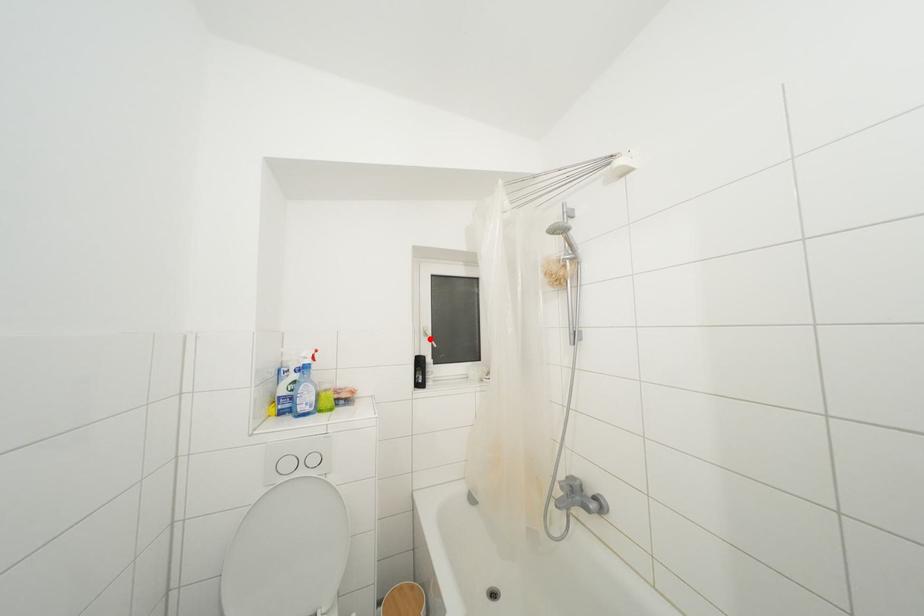
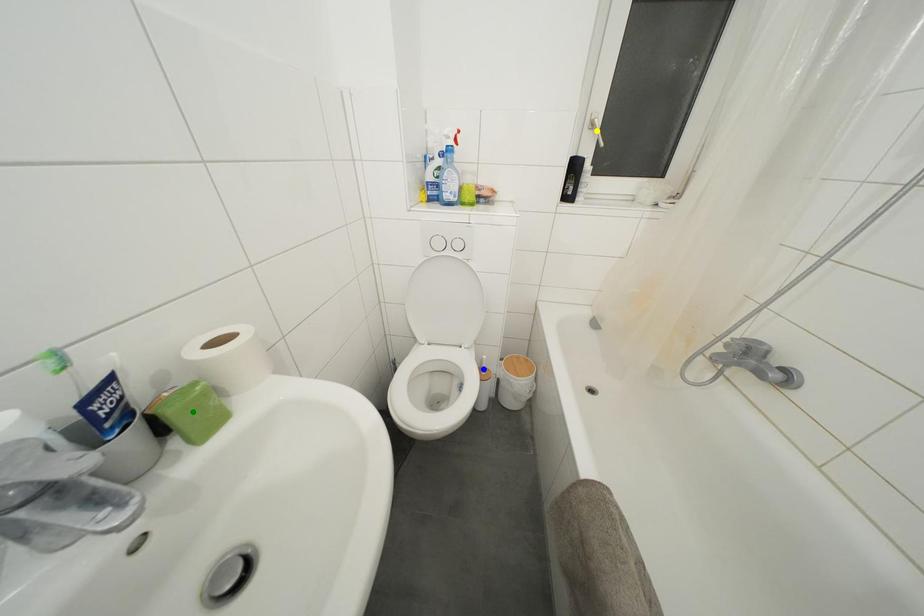
Question: I am providing you with two images of the same scene from different viewpoints. A red point is marked on the first image. You are given multiple points on the second image. Which point in image 2 is actually the same real-world point as the red point in image 1?

Choices:
 (A) yellow point
 (B) green point
 (C) blue point

Answer: (A)